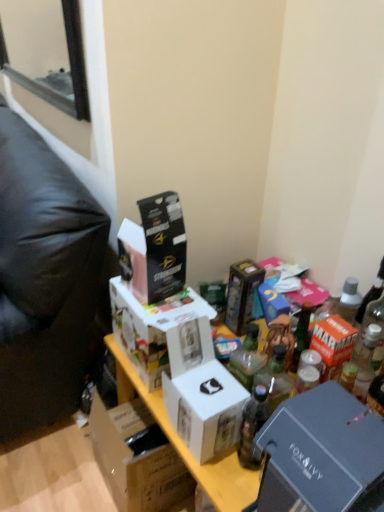
Question: Which direction should I rotate to look at translucent glass bottle at center, arranged as the 2th bottle when viewed from the back?

Choices:
 (A) right
 (B) left

Answer: (A)

Question: Does metallic gray box at lower right, the second box ordered from the bottom, lie in front of metallic gold box at center, acting as the 5th box starting from the bottom?

Choices:
 (A) no
 (B) yes

Answer: (B)

Question: Does metallic gray box at lower right, the second box ordered from the bottom, lie behind metallic gold box at center, acting as the 5th box starting from the bottom?

Choices:
 (A) yes
 (B) no

Answer: (B)

Question: Is metallic gray box at lower right, the second box ordered from the bottom, facing away from metallic gold box at center, acting as the 5th box starting from the bottom?

Choices:
 (A) no
 (B) yes

Answer: (A)

Question: Is metallic gray box at lower right, the second box ordered from the bottom, aimed at metallic gold box at center, acting as the 5th box starting from the bottom?

Choices:
 (A) yes
 (B) no

Answer: (B)

Question: Is metallic gray box at lower right, the 5th box when ordered from top to bottom, positioned beyond the bounds of metallic gold box at center, positioned as the second box in top-to-bottom order?

Choices:
 (A) no
 (B) yes

Answer: (B)

Question: Is metallic gray box at lower right, the second box ordered from the bottom, touching metallic gold box at center, positioned as the second box in top-to-bottom order?

Choices:
 (A) yes
 (B) no

Answer: (B)

Question: Considering the relative sizes of white cardboard box at center, the first box ordered from the bottom, and black cardboard box at upper center, the sixth box when ordered from bottom to top, in the image provided, is white cardboard box at center, the first box ordered from the bottom, shorter than black cardboard box at upper center, the sixth box when ordered from bottom to top,?

Choices:
 (A) yes
 (B) no

Answer: (B)

Question: Is white cardboard box at center, the first box ordered from the bottom, surrounding black cardboard box at upper center, the 1th box from the top?

Choices:
 (A) no
 (B) yes

Answer: (A)

Question: Can you confirm if white cardboard box at center, which appears as the sixth box when viewed from the top, is smaller than black cardboard box at upper center, the 1th box from the top?

Choices:
 (A) yes
 (B) no

Answer: (B)

Question: Is white cardboard box at center, the first box ordered from the bottom, far from black cardboard box at upper center, the sixth box when ordered from bottom to top?

Choices:
 (A) yes
 (B) no

Answer: (B)

Question: Is white cardboard box at center, the first box ordered from the bottom, outside black cardboard box at upper center, the 1th box from the top?

Choices:
 (A) no
 (B) yes

Answer: (B)

Question: Does white cardboard box at center, the first box ordered from the bottom, appear on the left side of black cardboard box at upper center, the sixth box when ordered from bottom to top?

Choices:
 (A) no
 (B) yes

Answer: (B)

Question: From the image's perspective, is black cardboard box at upper center, the 1th box from the top, beneath white cardboard box at center, the fourth box ordered from the bottom?

Choices:
 (A) no
 (B) yes

Answer: (A)